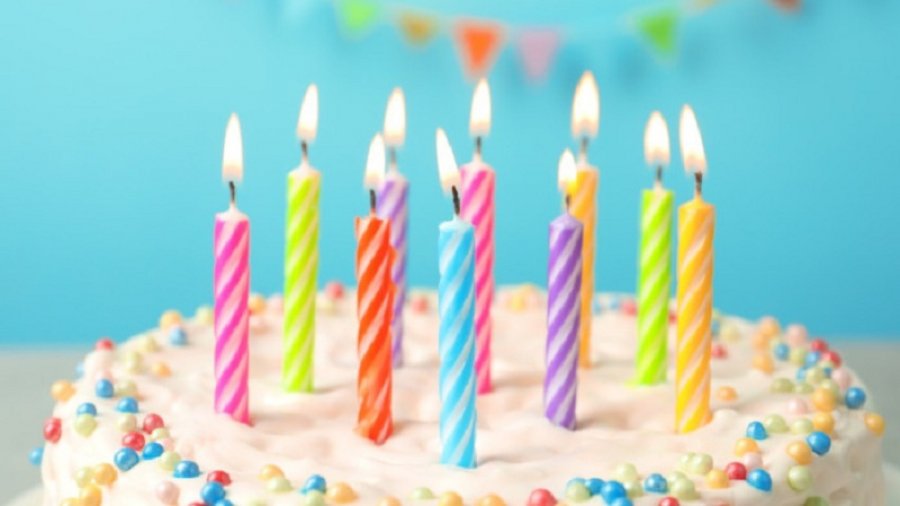
At what (x,y) coordinates should I click in order to perform the action: click on candle wicks. Please return your answer as a coordinate pair (x, y). This screenshot has height=506, width=900. Looking at the image, I should click on (229, 184), (304, 141), (372, 192), (391, 151), (453, 193), (475, 137), (567, 198), (583, 143), (658, 172), (696, 180).